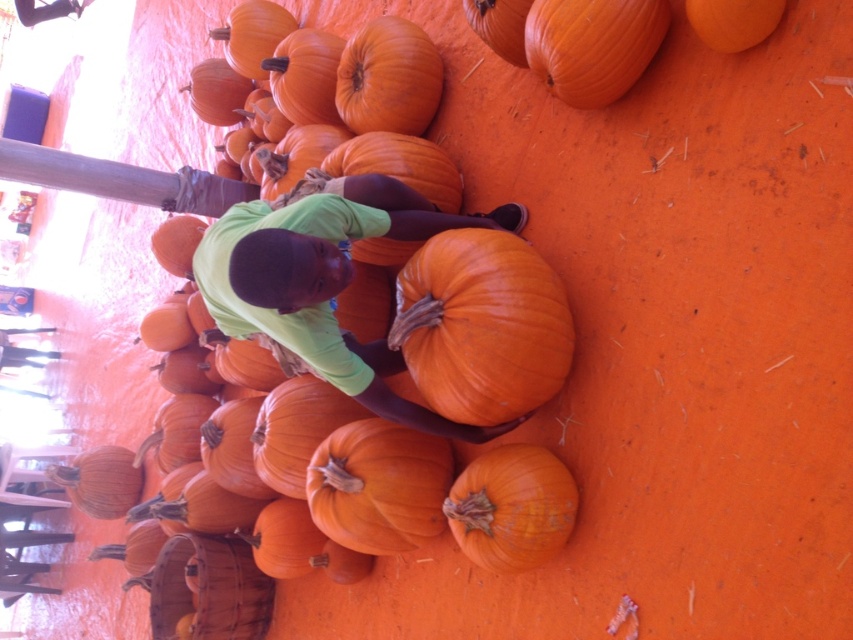
Question: Which of the following is the farthest from the observer?

Choices:
 (A) (x=643, y=8)
 (B) (x=421, y=38)

Answer: (B)

Question: Which point is closer to the camera taking this photo?

Choices:
 (A) (529, 13)
 (B) (434, 99)
 (C) (755, 33)

Answer: (C)

Question: Which is farther from the smooth orange pumpkin at center?

Choices:
 (A) smooth orange pumpkin at upper center
 (B) smooth orange pumpkin at lower left

Answer: (B)

Question: Is orange matte pumpkin at center smaller than orange matte pumpkin at upper right?

Choices:
 (A) no
 (B) yes

Answer: (A)

Question: Can you confirm if orange matte pumpkin at center is positioned below orange matte pumpkin at upper right?

Choices:
 (A) yes
 (B) no

Answer: (A)

Question: Does orange matte pumpkin at lower center have a greater width compared to smooth orange pumpkin at upper center?

Choices:
 (A) no
 (B) yes

Answer: (A)